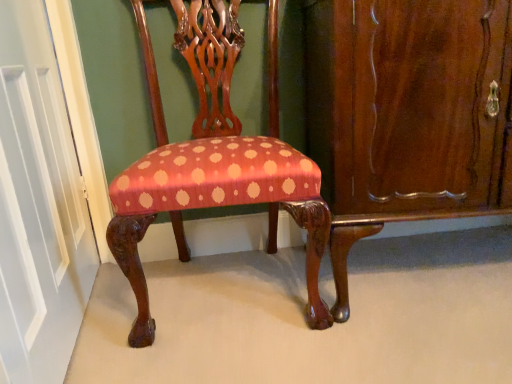
Question: Is the surface of mahogany wood dresser at right in direct contact with silky red fabric chair at center?

Choices:
 (A) yes
 (B) no

Answer: (B)

Question: Considering the relative sizes of mahogany wood dresser at right and silky red fabric chair at center in the image provided, is mahogany wood dresser at right taller than silky red fabric chair at center?

Choices:
 (A) yes
 (B) no

Answer: (B)

Question: Is mahogany wood dresser at right at the left side of silky red fabric chair at center?

Choices:
 (A) no
 (B) yes

Answer: (A)

Question: Considering the relative sizes of mahogany wood dresser at right and silky red fabric chair at center in the image provided, is mahogany wood dresser at right smaller than silky red fabric chair at center?

Choices:
 (A) yes
 (B) no

Answer: (B)

Question: Is mahogany wood dresser at right bigger than silky red fabric chair at center?

Choices:
 (A) no
 (B) yes

Answer: (B)

Question: Can you confirm if mahogany wood dresser at right is wider than silky red fabric chair at center?

Choices:
 (A) no
 (B) yes

Answer: (B)

Question: Would you consider silky red fabric chair at center to be distant from mahogany wood dresser at right?

Choices:
 (A) no
 (B) yes

Answer: (A)

Question: Can you confirm if silky red fabric chair at center is positioned to the right of mahogany wood dresser at right?

Choices:
 (A) yes
 (B) no

Answer: (B)

Question: Is silky red fabric chair at center further to camera compared to mahogany wood dresser at right?

Choices:
 (A) yes
 (B) no

Answer: (B)

Question: Is mahogany wood dresser at right at the back of silky red fabric chair at center?

Choices:
 (A) yes
 (B) no

Answer: (B)

Question: Does silky red fabric chair at center have a greater width compared to mahogany wood dresser at right?

Choices:
 (A) yes
 (B) no

Answer: (B)

Question: Does silky red fabric chair at center have a smaller size compared to mahogany wood dresser at right?

Choices:
 (A) no
 (B) yes

Answer: (B)

Question: Is silky red fabric chair at center at the right side of white painted wood door at left?

Choices:
 (A) no
 (B) yes

Answer: (B)